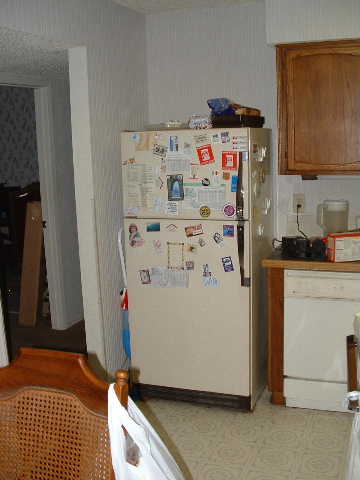
Where is `fridge magnet`? fridge magnet is located at coordinates (205, 211).